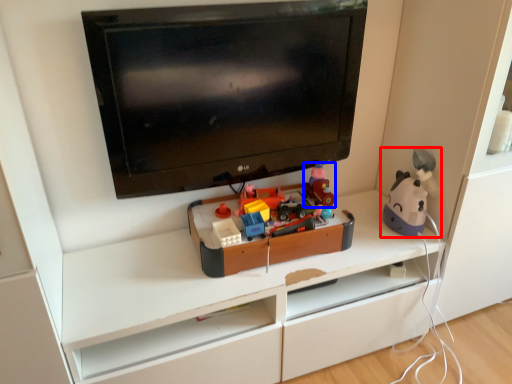
Question: Which of the following is the closest to the observer, toy (highlighted by a red box) or toy (highlighted by a blue box)?

Choices:
 (A) toy
 (B) toy

Answer: (A)